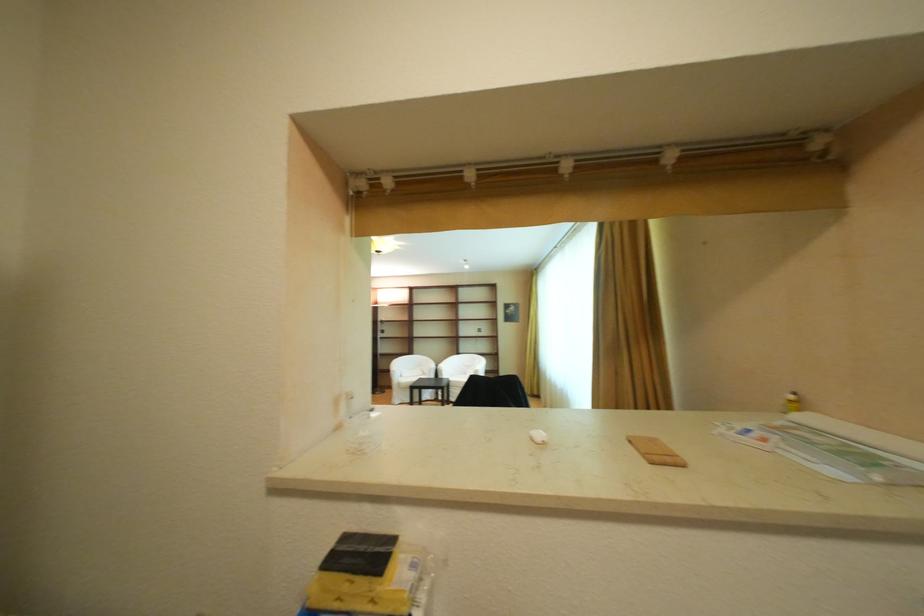
Find the location of a particular element. This screenshot has width=924, height=616. beaded pull chain is located at coordinates (350, 211).